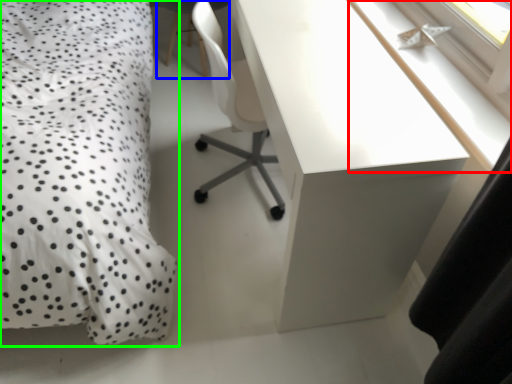
Question: Which object is the farthest from window sill (highlighted by a red box)? Choose among these: computer chair (highlighted by a blue box) or bed (highlighted by a green box).

Choices:
 (A) computer chair
 (B) bed

Answer: (A)